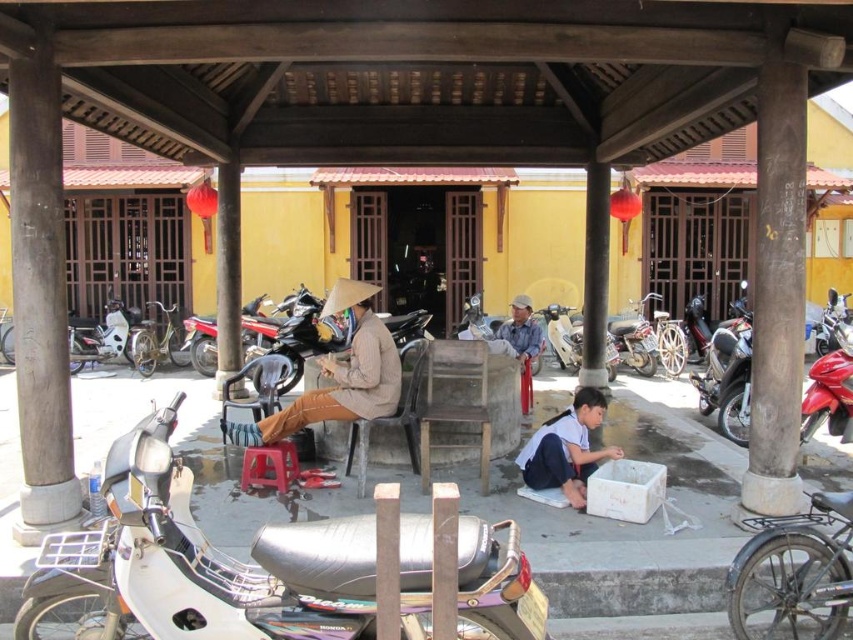
Can you confirm if shiny chrome motorcycle at lower right is positioned above white cotton shirt at lower center?

Incorrect, shiny chrome motorcycle at lower right is not positioned above white cotton shirt at lower center.

Is point (836, 508) farther from viewer compared to point (538, 432)?

That is False.

Find the location of `shiny chrome motorcycle at lower right`. shiny chrome motorcycle at lower right is located at coordinates tap(796, 570).

Can you confirm if silver metallic motorcycle at lower left is thinner than red plastic stool at center?

Incorrect, silver metallic motorcycle at lower left's width is not less than red plastic stool at center's.

Can you confirm if silver metallic motorcycle at lower left is positioned to the left of red plastic stool at center?

No, silver metallic motorcycle at lower left is not to the left of red plastic stool at center.

Is point (154, 456) positioned behind point (287, 444)?

No, (154, 456) is closer to viewer.

Locate an element on the screen. The width and height of the screenshot is (853, 640). silver metallic motorcycle at lower left is located at coordinates (193, 564).

Looking at this image, is shiny chrome motorcycle at lower right in front of brown matte conical hat at center?

Yes, it is.

Who is more distant from viewer, [837,545] or [379,364]?

The point [379,364] is more distant.

Who is more forward, (785, 573) or (238, 438)?

Positioned in front is point (785, 573).

Identify the location of shiny chrome motorcycle at lower right. The height and width of the screenshot is (640, 853). (796, 570).